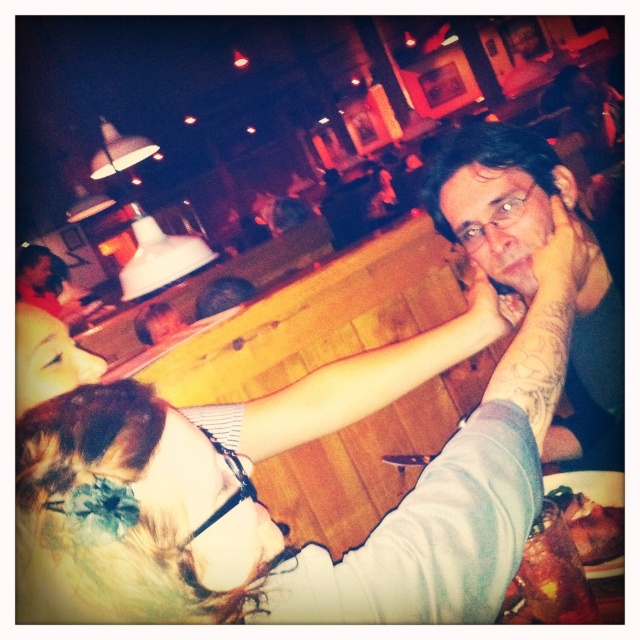
You are a customer sitting at the wooden table at lower right in the bar. You want to place your drink on the smooth wooden arm at center. Is the arm within your reach?

The smooth wooden arm at center is above the wooden table at lower right, so it is likely out of reach for placing a drink unless you stand up.

You are a bartender who needs to place a small drink coaster between the smooth wooden arm at center and the smooth skin hand at center. Given their widths, will the coaster fit snugly without overlapping either object?

The smooth wooden arm at center is wider than the smooth skin hand at center. Since the coaster needs to fit between them, the available space depends on the distance between the two objects, not just their widths. The provided information about their widths doesn

You are a person sitting in the booth and want to place your phone on the smooth wooden arm at center. Can you do that?

Yes, you can place your phone on the smooth wooden arm at center because it is a flat surface designed for such purposes.